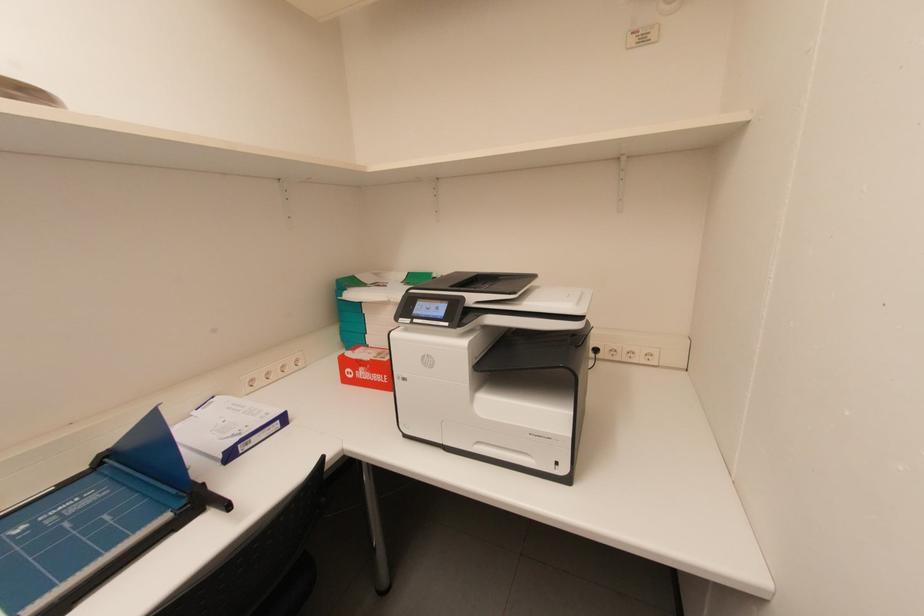
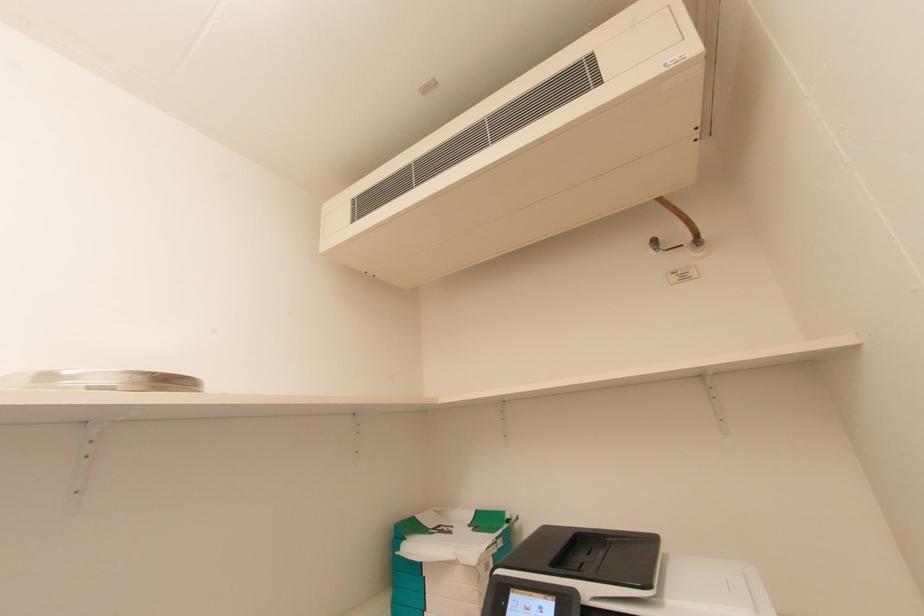
Question: The first image is from the beginning of the video and the second image is from the end. How did the camera likely rotate when shooting the video?

Choices:
 (A) Left
 (B) Right
 (C) Up
 (D) Down

Answer: (C)